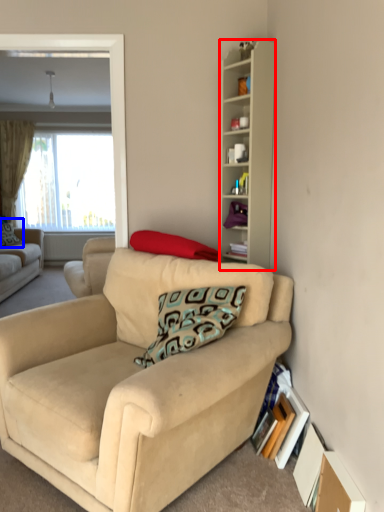
Question: Which object appears closest to the camera in this image, cabinetry (highlighted by a red box) or pillow (highlighted by a blue box)?

Choices:
 (A) cabinetry
 (B) pillow

Answer: (A)